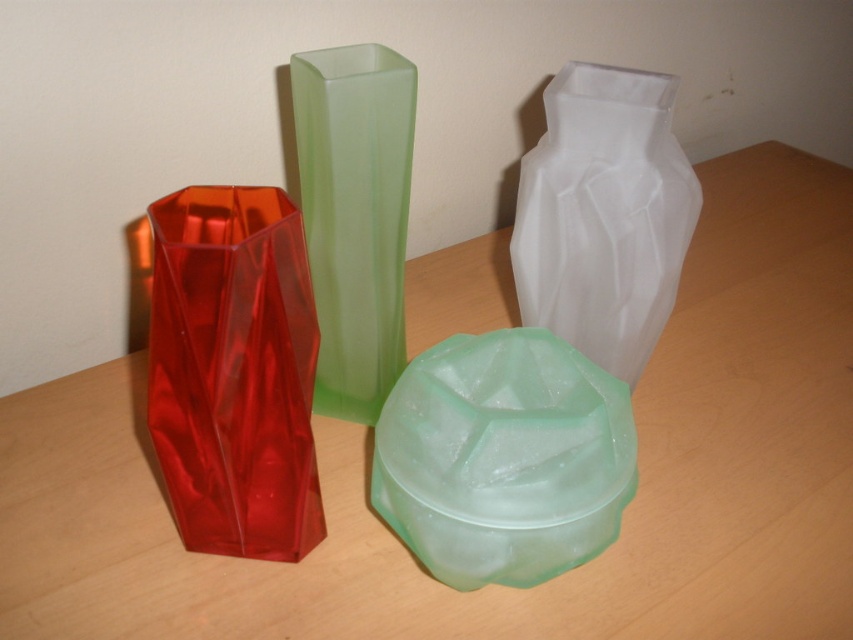
Between shiny red glass vase at left and frosted green vase at center, which one is positioned higher?

shiny red glass vase at left is above.

Is point (276, 390) more distant than point (599, 522)?

That is False.

This screenshot has height=640, width=853. What do you see at coordinates (233, 371) in the screenshot?
I see `shiny red glass vase at left` at bounding box center [233, 371].

You are a GUI agent. You are given a task and a screenshot of the screen. Output one action in this format:
    pyautogui.click(x=<x>, y=<y>)
    Task: Click on the shiny red glass vase at left
    
    Given the screenshot: What is the action you would take?
    pyautogui.click(x=233, y=371)

Who is more distant from viewer, (631, 88) or (395, 237)?

The point (631, 88) is behind.

Does transparent frosted vase at center come behind green frosted vase at center?

Yes, transparent frosted vase at center is further from the viewer.

Is point (624, 209) closer to viewer compared to point (355, 323)?

Yes, it is.

What are the coordinates of `transparent frosted vase at center` in the screenshot? It's located at (602, 214).

Is frosted green vase at center positioned before transparent frosted vase at center?

Yes, it is.

Between frosted green vase at center and transparent frosted vase at center, which one has less height?

frosted green vase at center

Between point (477, 397) and point (611, 122), which one is positioned behind?

Positioned behind is point (611, 122).

Locate an element on the screen. frosted green vase at center is located at coordinates (503, 458).